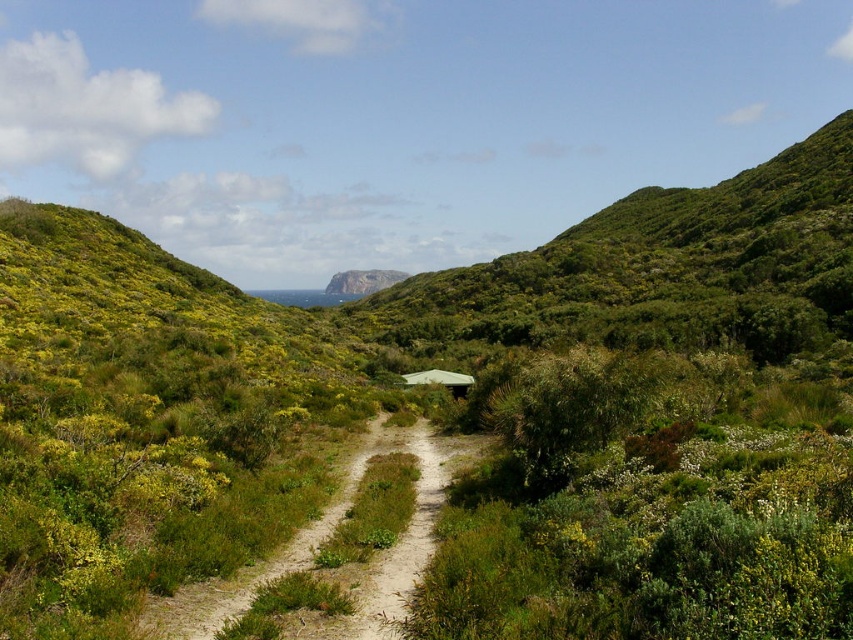
Is brown sandy dirt track at center to the right of rugged stone mountain at center from the viewer's perspective?

Indeed, brown sandy dirt track at center is positioned on the right side of rugged stone mountain at center.

Is brown sandy dirt track at center positioned at the back of rugged stone mountain at center?

That is False.

Which is behind, point (268, 564) or point (376, 289)?

Point (376, 289)

Find the location of a particular element. The image size is (853, 640). brown sandy dirt track at center is located at coordinates (328, 538).

Which is in front, point (396, 273) or point (450, 390)?

Positioned in front is point (450, 390).

What do you see at coordinates (363, 282) in the screenshot? The width and height of the screenshot is (853, 640). I see `rugged stone mountain at center` at bounding box center [363, 282].

In order to click on rugged stone mountain at center in this screenshot , I will do `click(363, 282)`.

The height and width of the screenshot is (640, 853). I want to click on rugged stone mountain at center, so click(363, 282).

Is brown sandy dirt track at center above green matte hut at center?

No.

Which of these two, brown sandy dirt track at center or green matte hut at center, stands taller?

With more height is green matte hut at center.

Locate an element on the screen. brown sandy dirt track at center is located at coordinates (328, 538).

Where is `brown sandy dirt track at center`? The width and height of the screenshot is (853, 640). brown sandy dirt track at center is located at coordinates (328, 538).